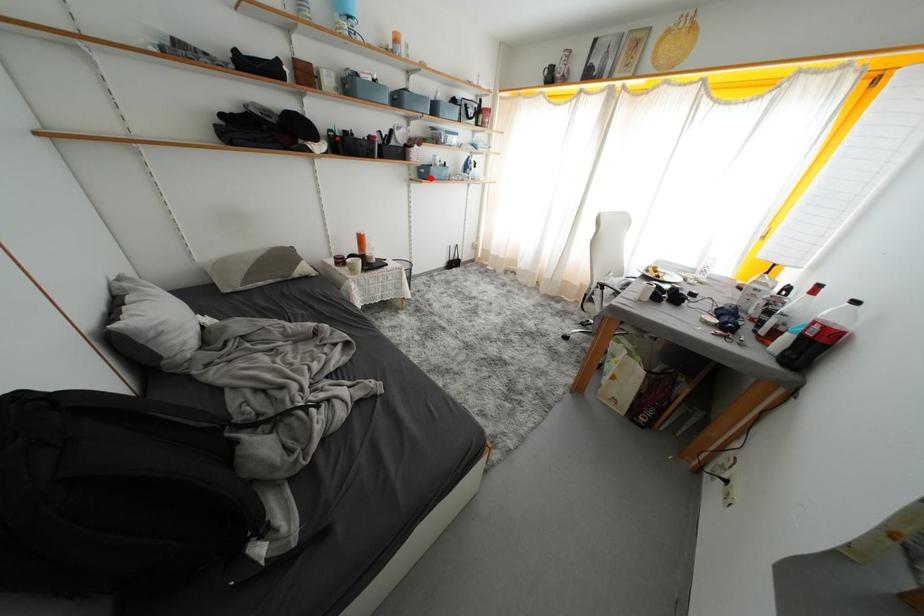
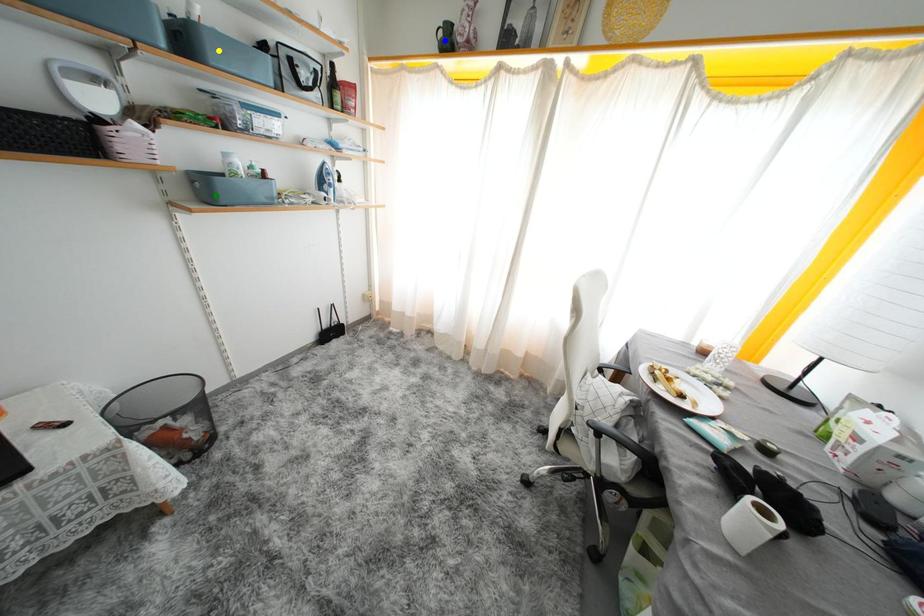
Question: I am providing you with two images of the same scene from different viewpoints. A red point is marked on the first image. You are given multiple points on the second image. Can you choose the point in image 2 that corresponds to the point in image 1?

Choices:
 (A) blue point
 (B) green point
 (C) yellow point

Answer: (B)